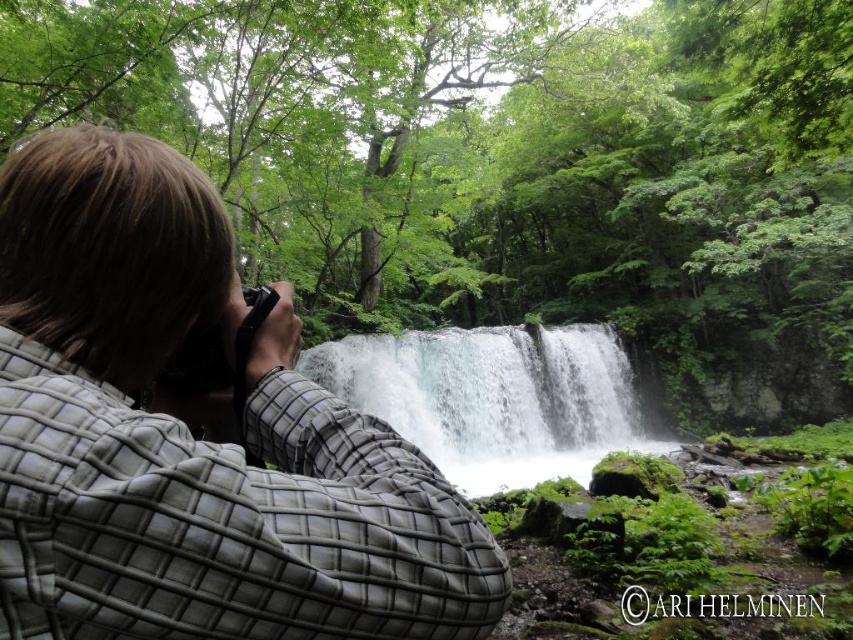
Is gray checkered shirt at center to the right of white frothy water at center from the viewer's perspective?

Incorrect, gray checkered shirt at center is not on the right side of white frothy water at center.

The height and width of the screenshot is (640, 853). Find the location of `gray checkered shirt at center`. gray checkered shirt at center is located at coordinates (190, 436).

Identify the location of gray checkered shirt at center. (190, 436).

Between green leafy forest at center and white frothy water at center, which one has less height?

With less height is white frothy water at center.

Between green leafy forest at center and white frothy water at center, which one appears on the right side from the viewer's perspective?

Positioned to the right is white frothy water at center.

What do you see at coordinates (506, 164) in the screenshot? Image resolution: width=853 pixels, height=640 pixels. I see `green leafy forest at center` at bounding box center [506, 164].

This screenshot has height=640, width=853. Identify the location of green leafy forest at center. (506, 164).

Measure the distance between green leafy forest at center and gray checkered shirt at center.

green leafy forest at center and gray checkered shirt at center are 22.20 meters apart.

Who is higher up, green leafy forest at center or gray checkered shirt at center?

green leafy forest at center is higher up.

Who is more distant from viewer, (590, 61) or (94, 556)?

The point (590, 61) is more distant.

Identify the location of green leafy forest at center. The height and width of the screenshot is (640, 853). (506, 164).